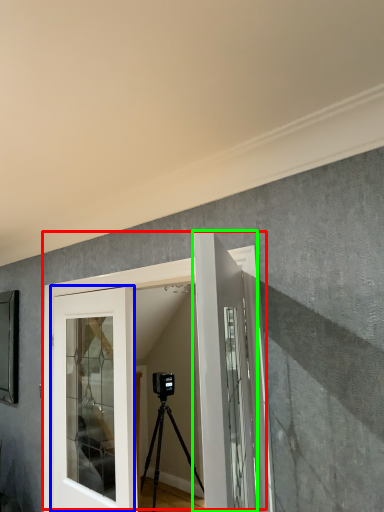
Question: Estimate the real-world distances between objects in this image. Which object is closer to door (highlighted by a red box), door (highlighted by a blue box) or door (highlighted by a green box)?

Choices:
 (A) door
 (B) door

Answer: (A)